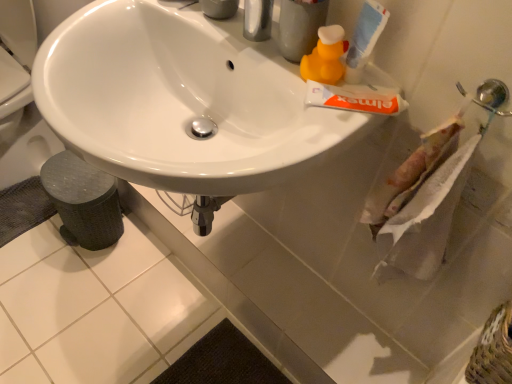
Question: In terms of size, does white glossy sink at center appear bigger or smaller than white paper towel at right?

Choices:
 (A) big
 (B) small

Answer: (A)

Question: Is white glossy sink at center wider or thinner than white paper towel at right?

Choices:
 (A) wide
 (B) thin

Answer: (A)

Question: Which is farther from the white matte tube of toothpaste at upper right, which is counted as the 1th toothpaste, starting from the top?

Choices:
 (A) gray textured bath mat at lower left
 (B) textured woven basket at lower right
 (C) white glossy sink at center
 (D) yellow rubber duck at upper right
 (E) white matte tube of toothpaste at upper right, which is counted as the first toothpaste, starting from the bottom

Answer: (A)

Question: Based on their relative distances, which object is nearer to the yellow rubber duck at upper right?

Choices:
 (A) white matte tube of toothpaste at upper right, which is counted as the 1th toothpaste, starting from the top
 (B) white glossy sink at center
 (C) white paper towel at right
 (D) white matte tube of toothpaste at upper right, marked as the second toothpaste in a top-to-bottom arrangement
 (E) gray textured bath mat at lower left

Answer: (A)